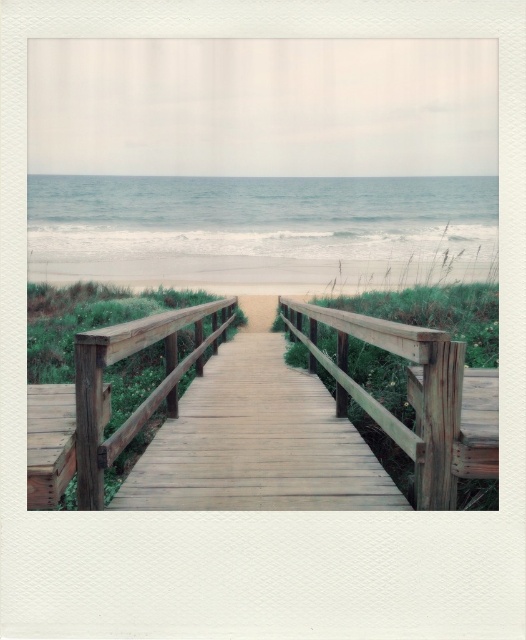
Is point (336, 508) behind point (264, 300)?

That is False.

Can you confirm if wooden bridge at center is taller than beige sandy beach at center?

Incorrect, wooden bridge at center's height is not larger of beige sandy beach at center's.

Is point (164, 476) positioned after point (271, 314)?

No, it is not.

Locate an element on the screen. The image size is (526, 640). wooden bridge at center is located at coordinates (257, 444).

Can you confirm if wooden bridge at center is positioned below wooden rail at center?

Indeed, wooden bridge at center is positioned under wooden rail at center.

Does wooden bridge at center have a lesser height compared to wooden rail at center?

Indeed, wooden bridge at center has a lesser height compared to wooden rail at center.

Identify the location of wooden bridge at center. This screenshot has height=640, width=526. (257, 444).

Find the location of a particular element. wooden bridge at center is located at coordinates [x=257, y=444].

Which is more to the right, wooden rail at center or beige sandy beach at center?

From the viewer's perspective, beige sandy beach at center appears more on the right side.

Can you confirm if wooden rail at center is positioned to the right of beige sandy beach at center?

In fact, wooden rail at center is to the left of beige sandy beach at center.

Locate an element on the screen. wooden rail at center is located at coordinates (146, 397).

I want to click on wooden rail at center, so click(x=146, y=397).